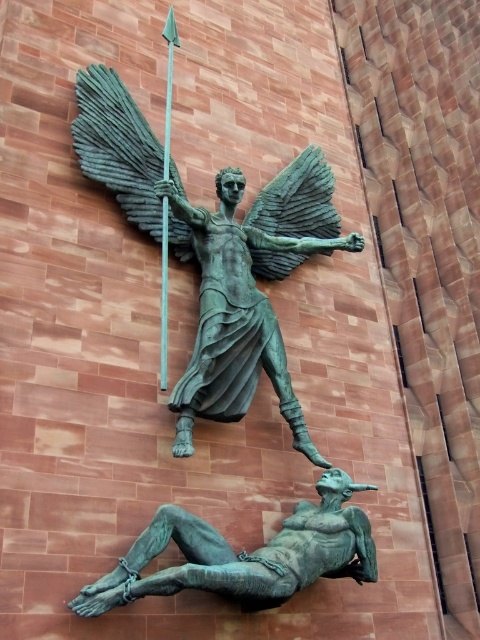
Can you confirm if bronze statue at upper center is positioned to the left of bronze figure at lower center?

No, bronze statue at upper center is not to the left of bronze figure at lower center.

Does point (266, 269) come behind point (273, 580)?

That is True.

Where is `bronze statue at upper center`? bronze statue at upper center is located at coordinates (215, 252).

Does point (280, 560) come closer to viewer compared to point (168, 32)?

That is True.

Does point (144, 552) lie in front of point (167, 97)?

That is True.

Find the location of `bronze figure at lower center`. bronze figure at lower center is located at coordinates (244, 554).

Between bronze statue at upper center and green metallic spear at center, which one is positioned lower?

bronze statue at upper center

Consider the image. Can you confirm if bronze statue at upper center is smaller than green metallic spear at center?

No, bronze statue at upper center is not smaller than green metallic spear at center.

Does point (232, 252) come farther from viewer compared to point (160, 298)?

Yes, it is behind point (160, 298).

The width and height of the screenshot is (480, 640). Identify the location of bronze statue at upper center. (215, 252).